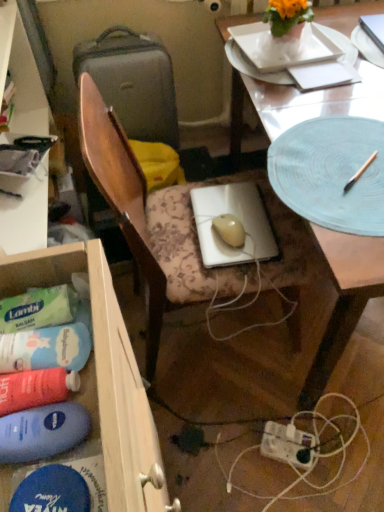
The image size is (384, 512). Identify the location of free space in front of white paper at upper right. [x=334, y=110].